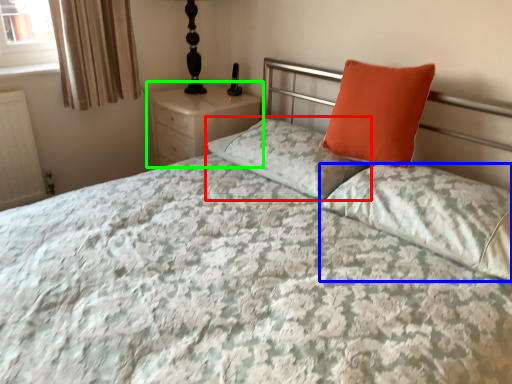
Question: Considering the real-world distances, which object is closest to pillow (highlighted by a red box)? pillow (highlighted by a blue box) or nightstand (highlighted by a green box).

Choices:
 (A) pillow
 (B) nightstand

Answer: (A)